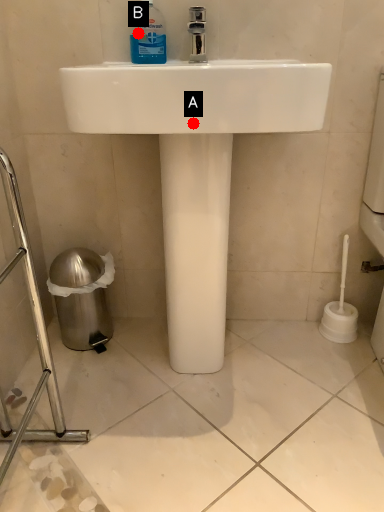
Question: Two points are circled on the image, labeled by A and B beside each circle. Which point appears farthest from the camera in this image?

Choices:
 (A) A is further
 (B) B is further

Answer: (B)